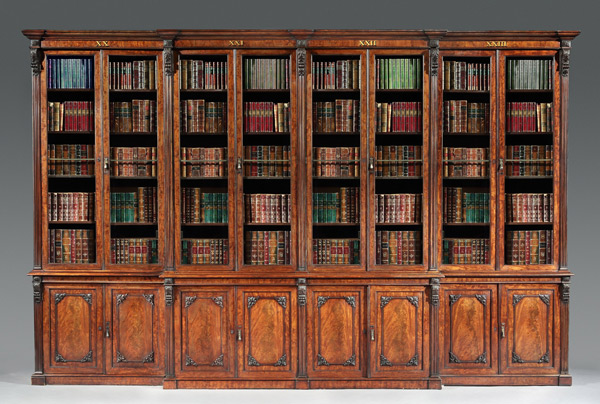
This screenshot has width=600, height=404. Find the location of `cabinets`. cabinets is located at coordinates (82, 328), (124, 324), (194, 326), (259, 328), (326, 336), (421, 319), (463, 328), (546, 328).